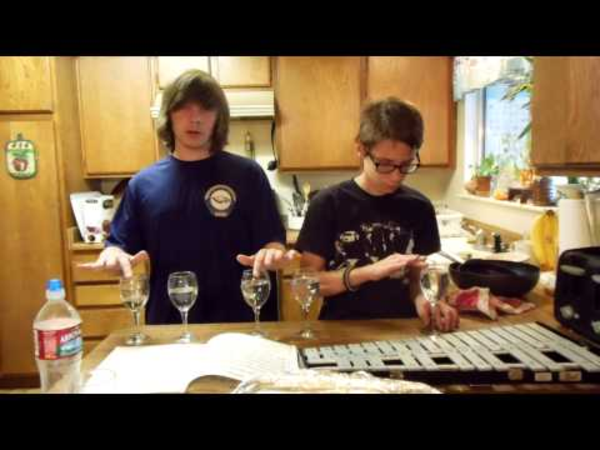
I want to click on rightmost cabinet, so click(x=572, y=119).